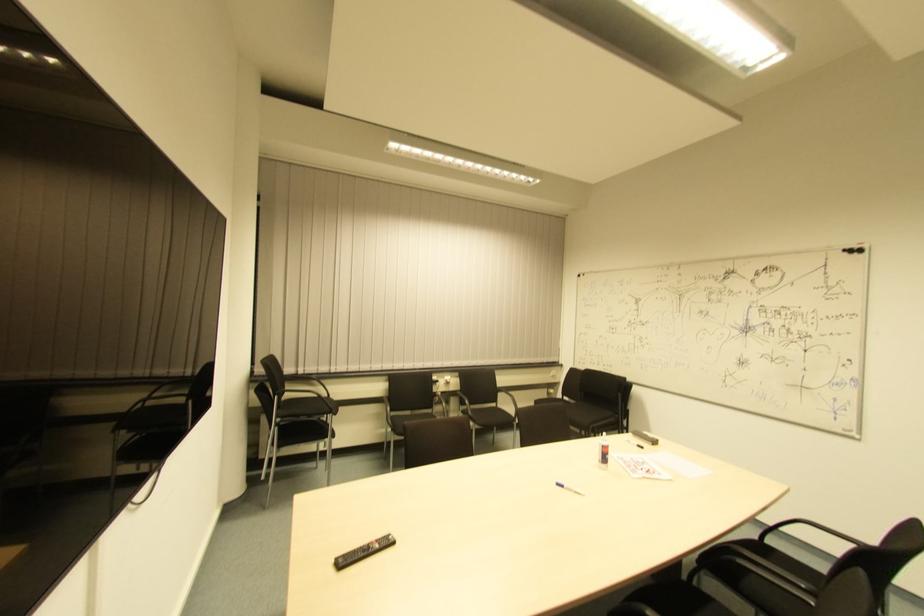
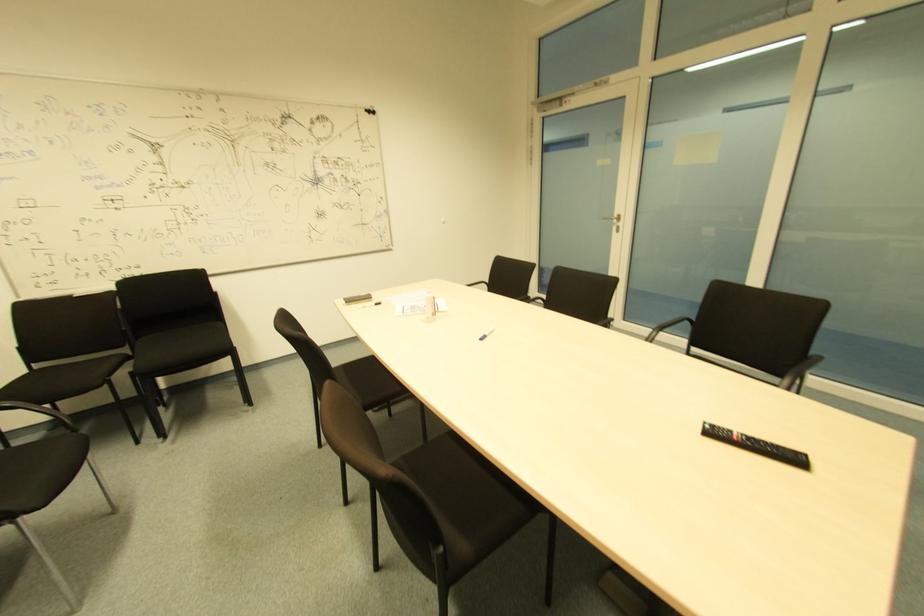
The point at (564, 400) is marked in the first image. Where is the corresponding point in the second image?

(34, 370)